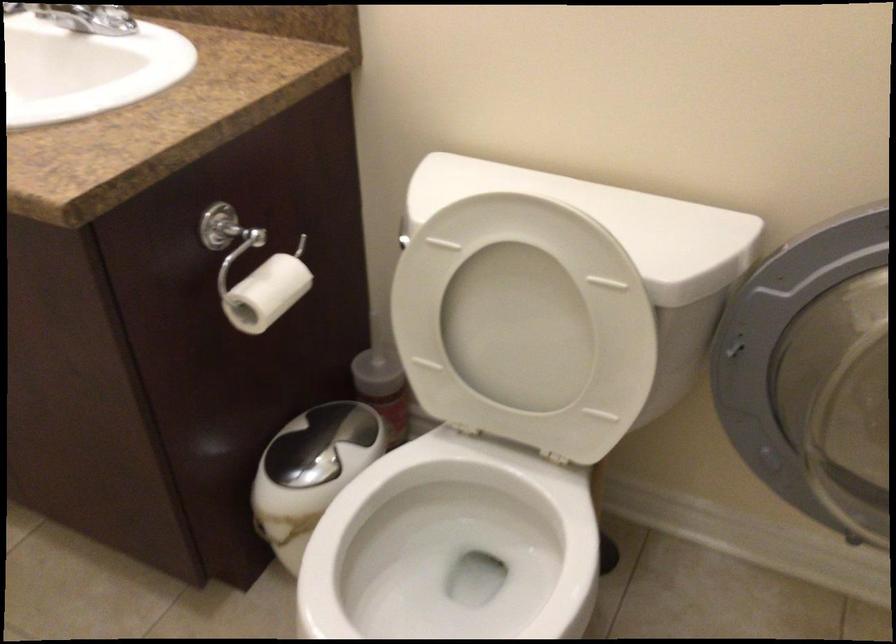
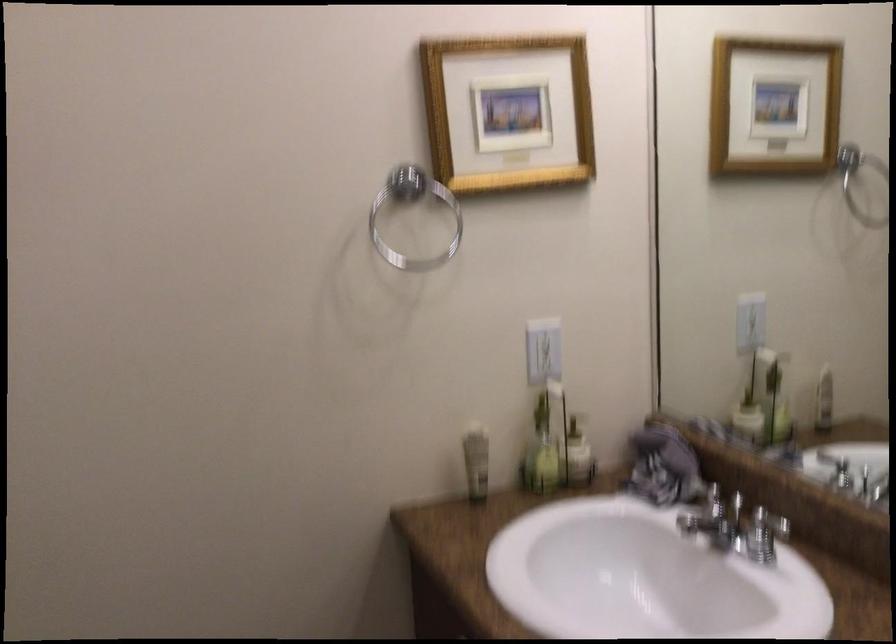
The first image is from the beginning of the video and the second image is from the end. How did the camera likely rotate when shooting the video?

The camera rotated toward left-up.